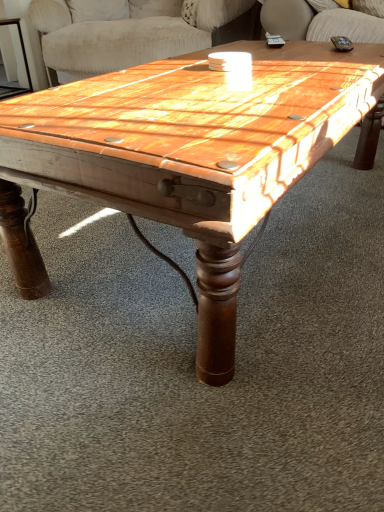
Question: From a real-world perspective, is wooden coffee table at center physically located above or below wooden swivel chair at upper center?

Choices:
 (A) below
 (B) above

Answer: (A)

Question: Does point (251, 210) appear closer or farther from the camera than point (147, 47)?

Choices:
 (A) farther
 (B) closer

Answer: (B)

Question: Estimate the real-world distances between objects in this image. Which object is farther from the wooden swivel chair at upper center?

Choices:
 (A) wooden coffee table at center
 (B) wooden side table at left

Answer: (A)

Question: Estimate the real-world distances between objects in this image. Which object is farther from the wooden swivel chair at upper center?

Choices:
 (A) wooden coffee table at center
 (B) wooden side table at left

Answer: (A)